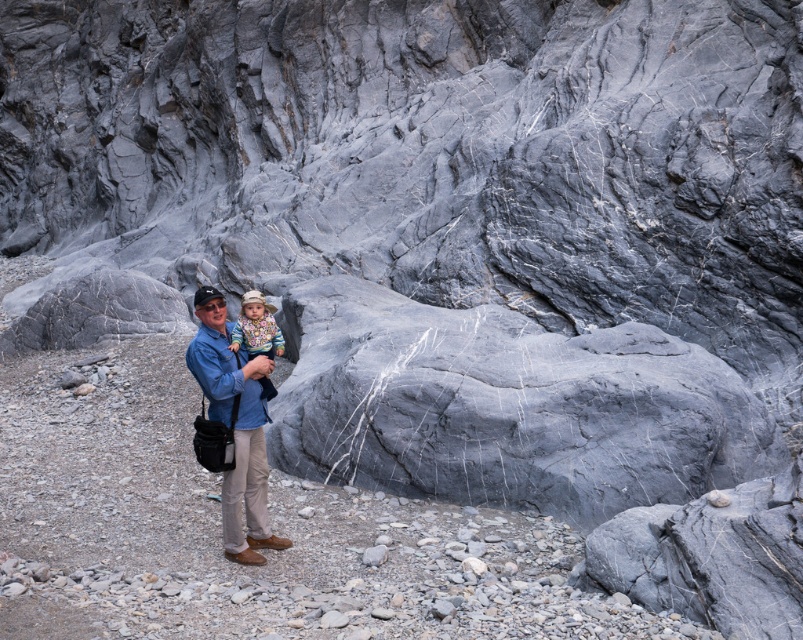
You are a photographer trying to capture a photo of the two people in the rocky landscape. The scene requires the person wearing the matte blue shirt at center to be in the foreground while the multicolored knitted sweater at center should be slightly blurred in the background. Based on their positions, is this possible?

The matte blue shirt at center is located below the multicolored knitted sweater at center. Since the matte blue shirt is lower in position, it can be placed in the foreground while the multicolored knitted sweater at center remains in the background, making it possible to achieve the desired effect with proper camera focus.